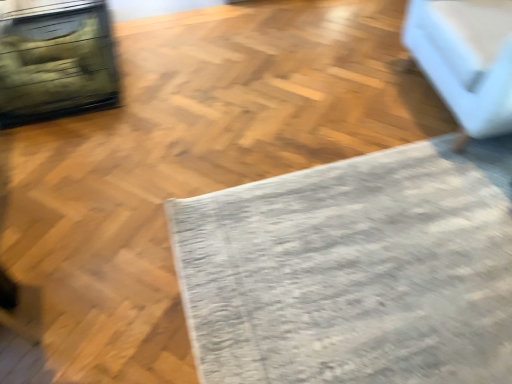
Question: Does gray textured mat at center have a lesser height compared to white fabric couch at upper right?

Choices:
 (A) yes
 (B) no

Answer: (A)

Question: Considering the relative positions of gray textured mat at center and white fabric couch at upper right in the image provided, is gray textured mat at center to the right of white fabric couch at upper right from the viewer's perspective?

Choices:
 (A) no
 (B) yes

Answer: (A)

Question: Would you say white fabric couch at upper right is part of gray textured mat at center's contents?

Choices:
 (A) yes
 (B) no

Answer: (B)

Question: Is gray textured mat at center facing towards white fabric couch at upper right?

Choices:
 (A) no
 (B) yes

Answer: (A)

Question: Is gray textured mat at center in front of white fabric couch at upper right?

Choices:
 (A) yes
 (B) no

Answer: (A)

Question: From the image's perspective, is gray textured mat at center located beneath white fabric couch at upper right?

Choices:
 (A) yes
 (B) no

Answer: (A)

Question: From the image's perspective, does white fabric couch at upper right appear higher than gray textured mat at center?

Choices:
 (A) yes
 (B) no

Answer: (A)

Question: Considering the relative positions of white fabric couch at upper right and gray textured mat at center in the image provided, is white fabric couch at upper right in front of gray textured mat at center?

Choices:
 (A) no
 (B) yes

Answer: (A)

Question: Is white fabric couch at upper right behind gray textured mat at center?

Choices:
 (A) no
 (B) yes

Answer: (B)

Question: Is white fabric couch at upper right thinner than gray textured mat at center?

Choices:
 (A) yes
 (B) no

Answer: (A)

Question: From a real-world perspective, is white fabric couch at upper right on top of gray textured mat at center?

Choices:
 (A) no
 (B) yes

Answer: (B)

Question: Does white fabric couch at upper right appear on the right side of gray textured mat at center?

Choices:
 (A) yes
 (B) no

Answer: (A)

Question: In the image, is white fabric couch at upper right positioned in front of or behind gray textured mat at center?

Choices:
 (A) behind
 (B) front

Answer: (A)